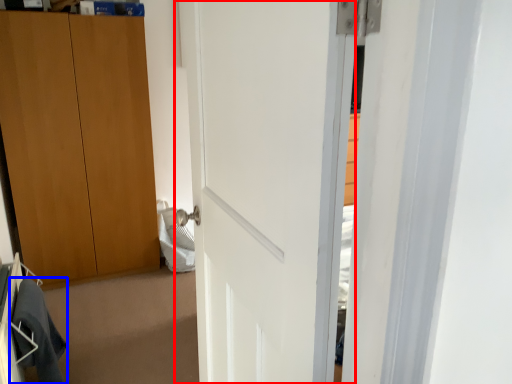
Question: Which object appears farthest to the camera in this image, door (highlighted by a red box) or robe (highlighted by a blue box)?

Choices:
 (A) door
 (B) robe

Answer: (B)